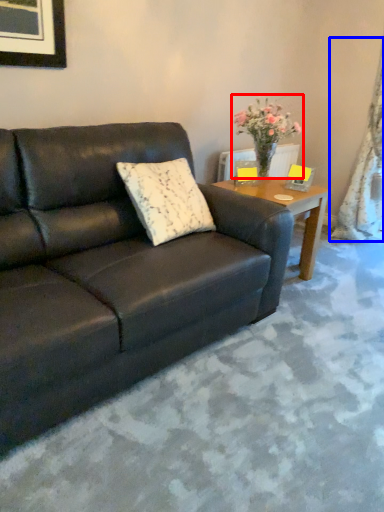
Question: Which of the following is the farthest to the observer, houseplant (highlighted by a red box) or curtain (highlighted by a blue box)?

Choices:
 (A) houseplant
 (B) curtain

Answer: (B)